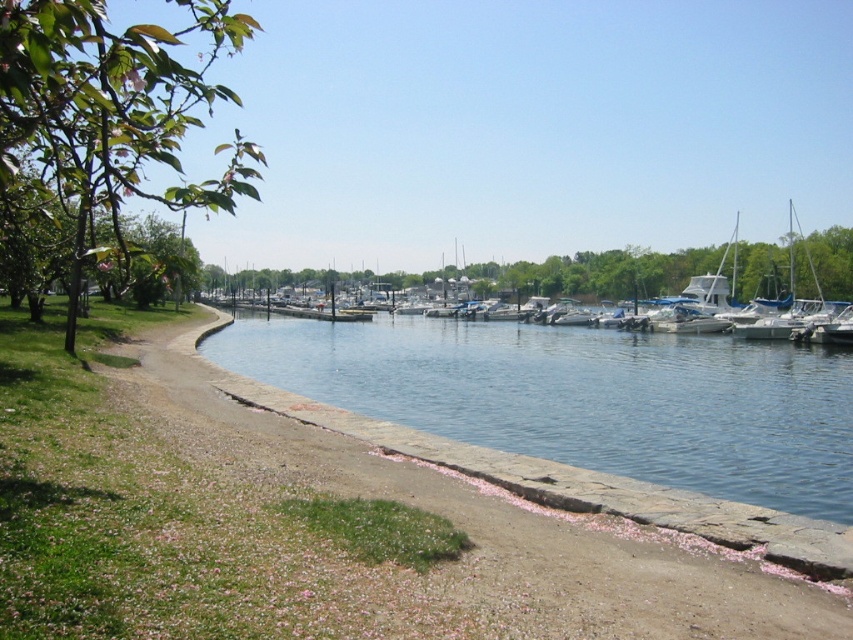
Question: Does clear blue water at center have a greater width compared to white glossy boat at center?

Choices:
 (A) yes
 (B) no

Answer: (B)

Question: Does clear blue water at center have a smaller size compared to white glossy boat at center?

Choices:
 (A) no
 (B) yes

Answer: (B)

Question: Does clear blue water at center have a lesser width compared to white glossy boat at center?

Choices:
 (A) no
 (B) yes

Answer: (B)

Question: Among these objects, which one is farthest from the camera?

Choices:
 (A) white glossy boat at center
 (B) clear blue water at center

Answer: (A)

Question: Which point is closer to the camera taking this photo?

Choices:
 (A) (775, 413)
 (B) (845, 291)

Answer: (A)